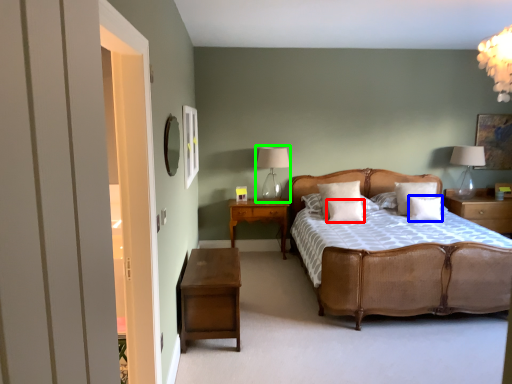
Question: Estimate the real-world distances between objects in this image. Which object is closer to pillow (highlighted by a red box), pillow (highlighted by a blue box) or table lamp (highlighted by a green box)?

Choices:
 (A) pillow
 (B) table lamp

Answer: (A)